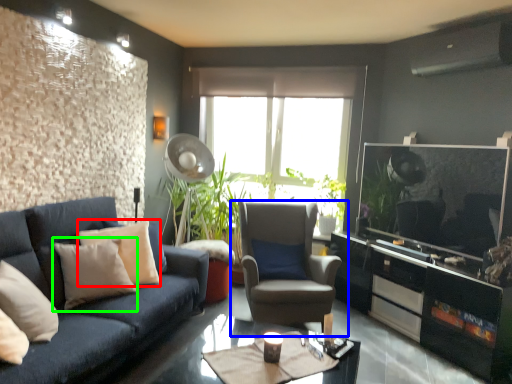
Question: Based on their relative distances, which object is nearer to pillow (highlighted by a red box)? Choose from chair (highlighted by a blue box) and pillow (highlighted by a green box).

Choices:
 (A) chair
 (B) pillow

Answer: (B)